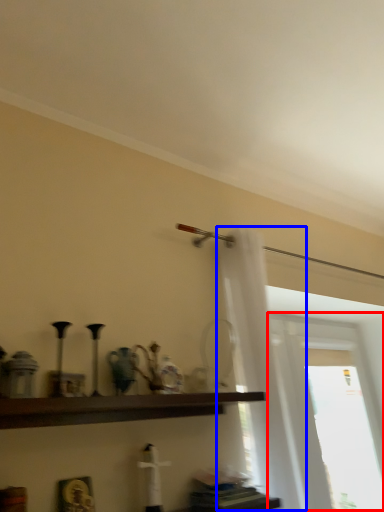
Question: Which point is closer to the camera, window (highlighted by a red box) or shower curtain (highlighted by a blue box)?

Choices:
 (A) window
 (B) shower curtain

Answer: (B)